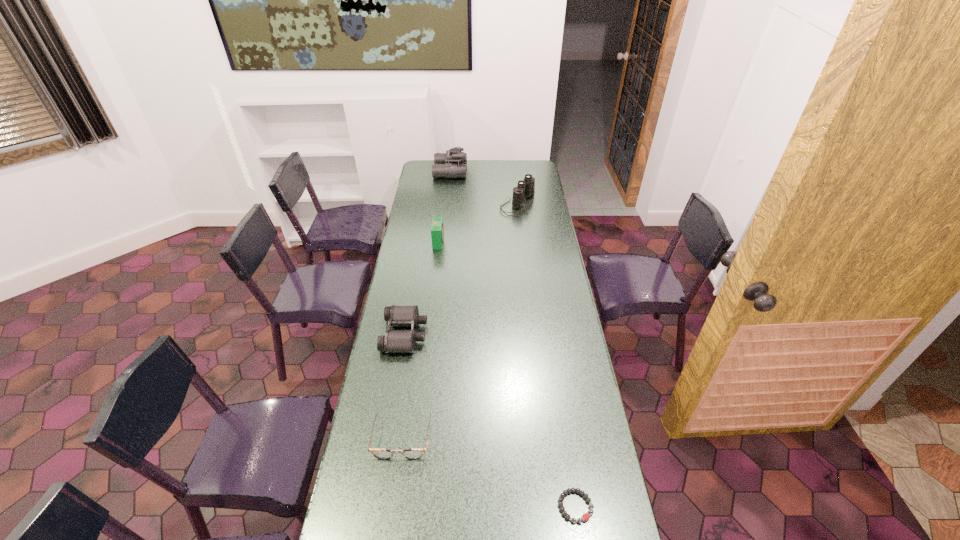
I want to click on binoculars that is at the right edge, so click(526, 188).

Where is `bracelet at the right edge`? The width and height of the screenshot is (960, 540). bracelet at the right edge is located at coordinates (585, 517).

Locate an element on the screen. object that is at the far left corner is located at coordinates (452, 164).

This screenshot has width=960, height=540. I want to click on free space at the far edge of the desktop, so click(x=477, y=171).

The width and height of the screenshot is (960, 540). What are the coordinates of `vacant area at the left edge of the desktop` in the screenshot? It's located at (424, 193).

Locate an element on the screen. This screenshot has width=960, height=540. free space at the right edge of the desktop is located at coordinates [x=547, y=304].

Find the location of a particular element. The width and height of the screenshot is (960, 540). free area in between the shortest object and the farthest binoculars is located at coordinates (513, 339).

This screenshot has height=540, width=960. What are the coordinates of `free area in between the second shortest object and the farthest object` in the screenshot? It's located at (426, 305).

Image resolution: width=960 pixels, height=540 pixels. I want to click on blank region between the fourth nearest object and the bracelet, so click(x=507, y=374).

Where is `empty space between the bracelet and the farthest object`? Image resolution: width=960 pixels, height=540 pixels. empty space between the bracelet and the farthest object is located at coordinates (513, 339).